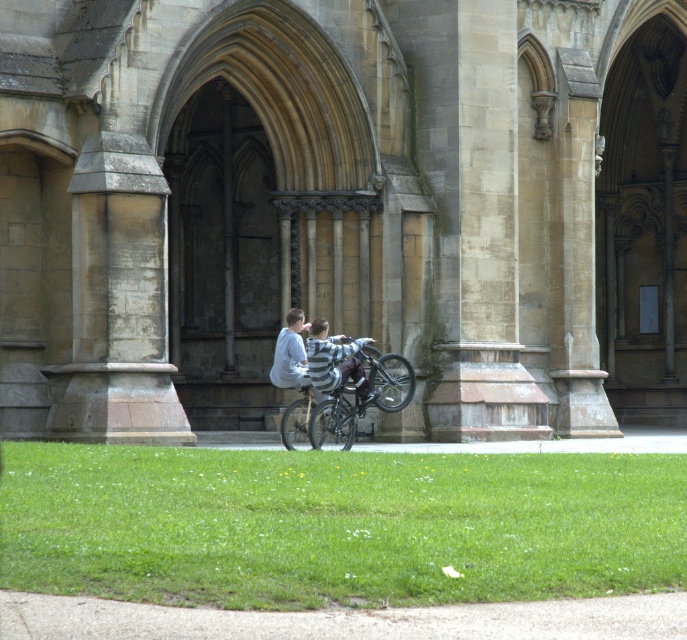
You are standing on the green grass at lower center and want to look up at the stone church at center. In which direction should you move your head?

The stone church at center is above green grass at lower center, so you should look upward to see it.

You are standing at the entrance of the grand stone building and want to take a shortcut to the bicycle. Which direction should you head to reach the shiny metallic bicycle at center from the green grass at lower center?

The green grass at lower center is located below the shiny metallic bicycle at center, so you should head upwards towards the shiny metallic bicycle at center to reach it from the green grass at lower center.